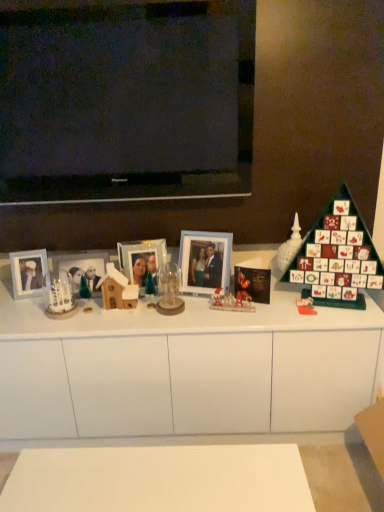
What are the coordinates of `free space between wooden house at center, the first toy from the left, and clear glass ornament at center, positioned as the fourth toy in right-to-left order` in the screenshot? It's located at (139, 310).